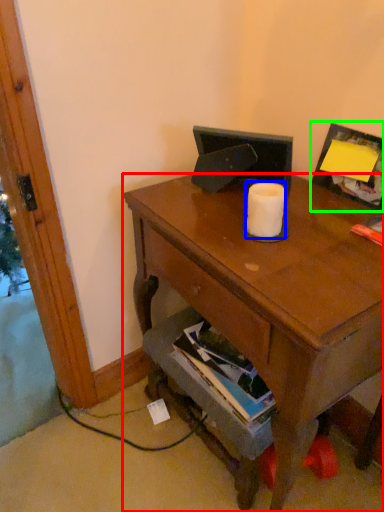
Question: Which is farther away from desk (highlighted by a red box)? toilet paper (highlighted by a blue box) or picture frame (highlighted by a green box)?

Choices:
 (A) toilet paper
 (B) picture frame

Answer: (B)